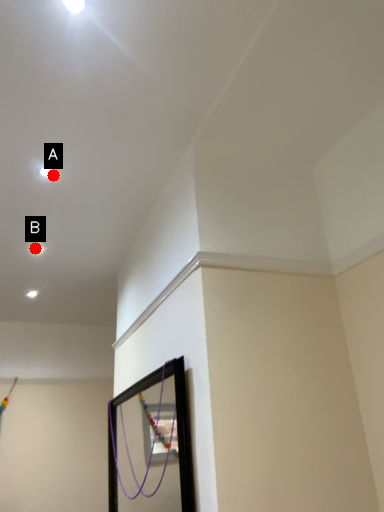
Question: Two points are circled on the image, labeled by A and B beside each circle. Which point appears farthest from the camera in this image?

Choices:
 (A) A is further
 (B) B is further

Answer: (B)